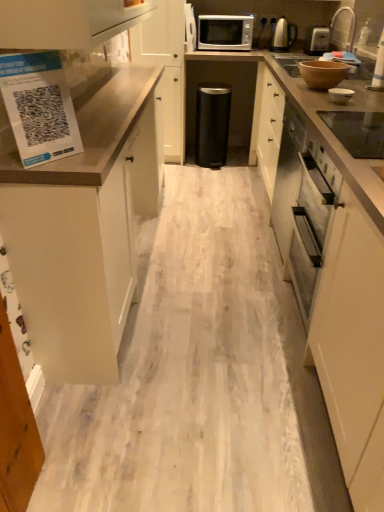
This screenshot has width=384, height=512. Find the location of `free space in front of black matte trash can at center, which is the second appliance in top-to-bottom order`. free space in front of black matte trash can at center, which is the second appliance in top-to-bottom order is located at coordinates (223, 175).